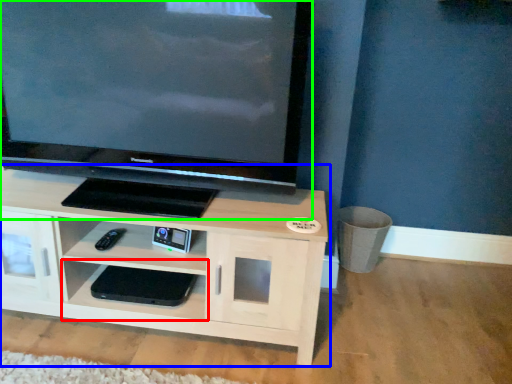
Question: Which is farther away from shelf (highlighted by a red box)? shelf (highlighted by a blue box) or television (highlighted by a green box)?

Choices:
 (A) shelf
 (B) television

Answer: (B)